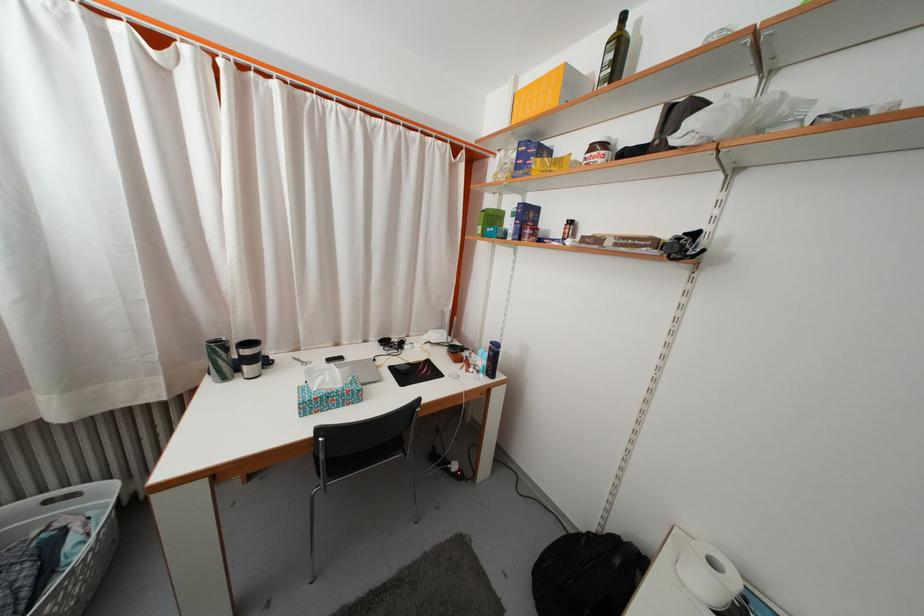
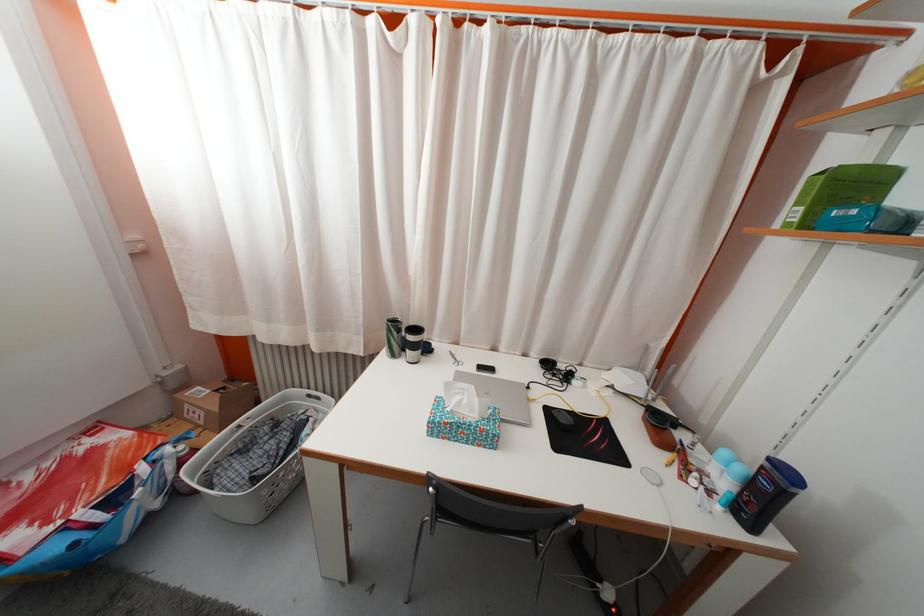
Question: The images are taken continuously from a first-person perspective. In which direction is your viewpoint rotating?

Choices:
 (A) Left
 (B) Right
 (C) Up
 (D) Down

Answer: (A)